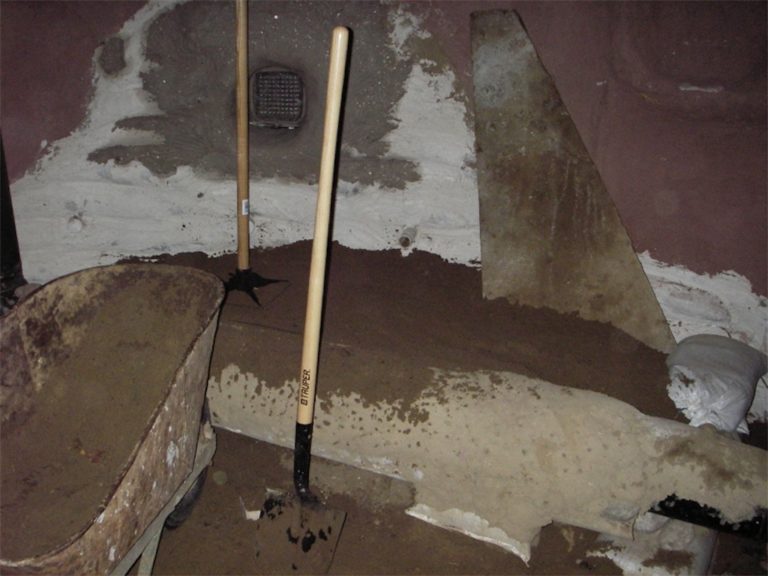
The width and height of the screenshot is (768, 576). I want to click on wall grate, so click(x=273, y=88).